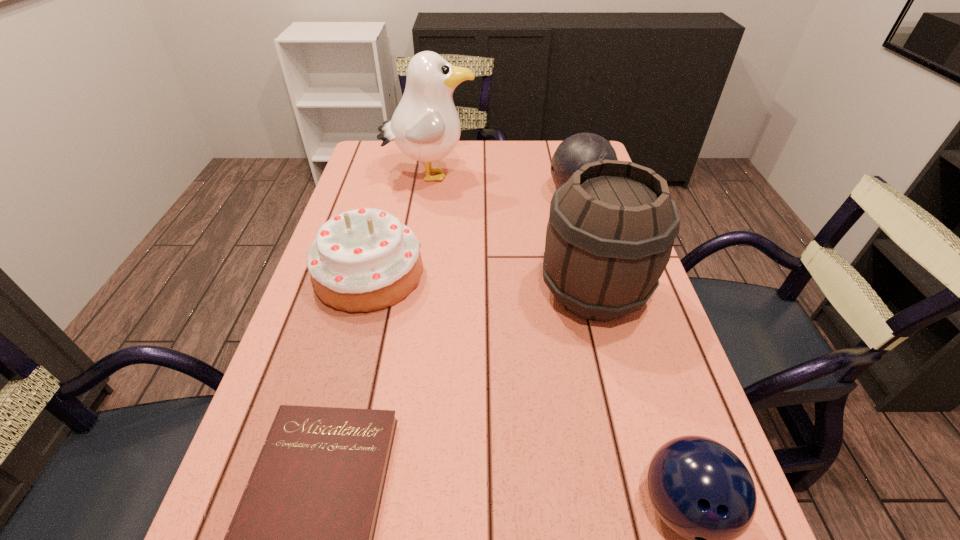
At what (x,y) coordinates should I click in order to perform the action: click on gull. Please return your answer as a coordinate pair (x, y). Looking at the image, I should click on (425, 126).

You are a GUI agent. You are given a task and a screenshot of the screen. Output one action in this format:
    pyautogui.click(x=<x>, y=<y>)
    Task: Click on the wine bucket
    The width and height of the screenshot is (960, 540).
    Given the screenshot: What is the action you would take?
    pyautogui.click(x=611, y=229)

This screenshot has height=540, width=960. What are the coordinates of `the taller bowling ball` in the screenshot? It's located at (577, 150).

Locate an element on the screen. cake is located at coordinates (363, 260).

At what (x,y) coordinates should I click in order to perform the action: click on vacant space located on the beak of the gull. Please return your answer as a coordinate pair (x, y). Looking at the image, I should click on [x=520, y=176].

Identify the location of blank area located 0.350m on the back of the wine bucket. (564, 180).

Where is `vacant region located 0.060m on the grip area of the taller bowling ball`? This screenshot has width=960, height=540. vacant region located 0.060m on the grip area of the taller bowling ball is located at coordinates (527, 195).

At what (x,y) coordinates should I click in order to perform the action: click on blank space located 0.300m on the grip area of the taller bowling ball. Please return your answer as a coordinate pair (x, y). This screenshot has height=540, width=960. Looking at the image, I should click on (444, 195).

I want to click on free space located on the grip area of the taller bowling ball, so click(x=444, y=195).

This screenshot has height=540, width=960. Find the location of `vacant space situated on the right of the cake`. vacant space situated on the right of the cake is located at coordinates (554, 274).